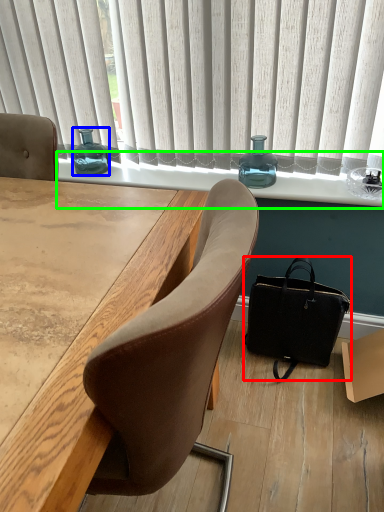
Question: Based on their relative distances, which object is nearer to handbag (highlighted by a red box)? Choose from bottle (highlighted by a blue box) and window sill (highlighted by a green box).

Choices:
 (A) bottle
 (B) window sill

Answer: (B)